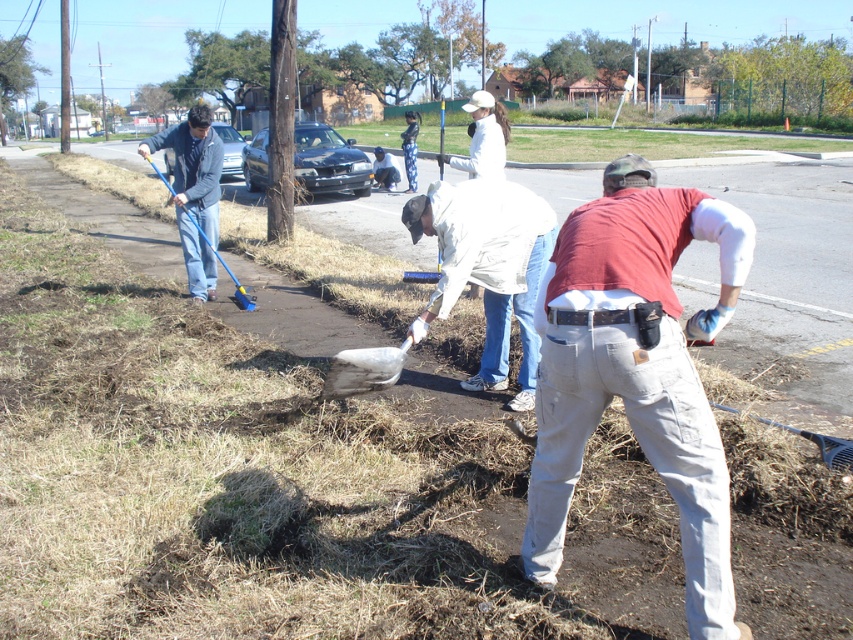
You are standing at the center of the scene and want to reach the blue plastic shovel at left without stepping on the denim jeans at lower right. Is this possible?

The denim jeans at lower right is in front of the blue plastic shovel at left, so you would need to step over or around the denim jeans at lower right to reach the blue plastic shovel at left without stepping on it.

You are a photographer standing at the edge of the work area. You want to capture a photo that includes both the denim jeans at lower right and the white matte jacket at center. Which object should you adjust your camera angle to focus on first to ensure both are in frame?

The denim jeans at lower right is positioned on the right side of white matte jacket at center. To ensure both are in frame, focus on the white matte jacket at center first, then adjust the camera angle to include the denim jeans at lower right on its right side.